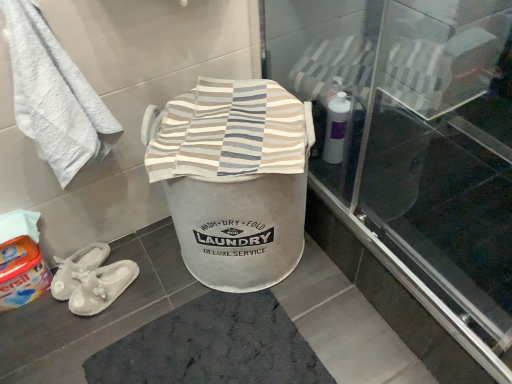
The image size is (512, 384). Identify the location of vacant space underneath white soft towel at upper left (from a real-world perspective). (142, 248).